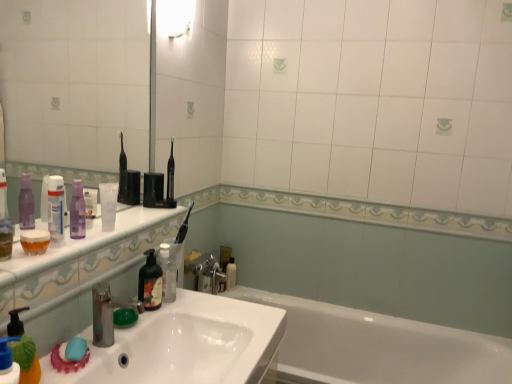
The height and width of the screenshot is (384, 512). What are the coordinates of `vacant area on the back side of purple matte lotion at upper left, the second toiletry positioned from the bottom` in the screenshot? It's located at [132, 218].